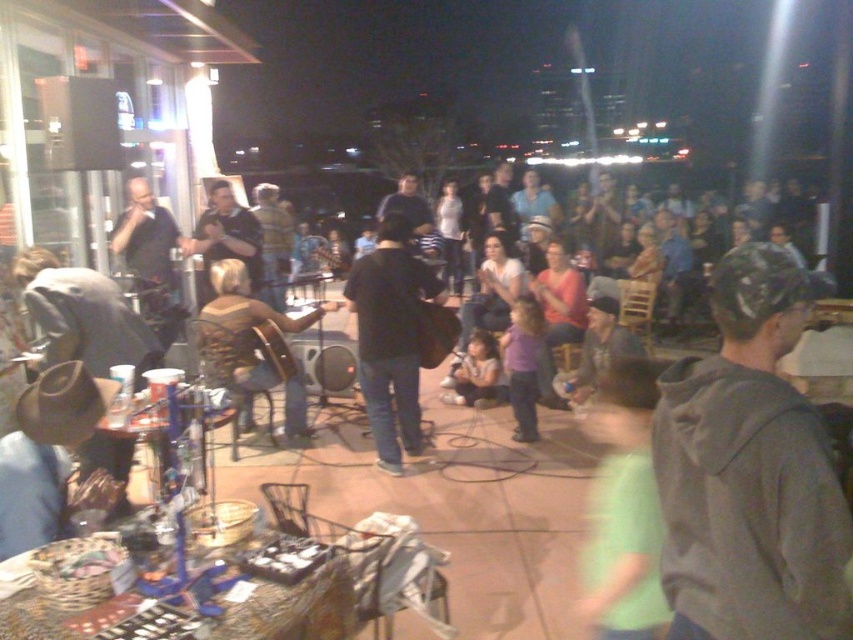
Question: Which point is farther from the camera taking this photo?

Choices:
 (A) [381, 381]
 (B) [675, 384]
 (C) [248, 348]

Answer: (C)

Question: Does black leather jacket at center come in front of brown leather guitar at center?

Choices:
 (A) yes
 (B) no

Answer: (A)

Question: Is gray matte hoodie at center further to camera compared to brown leather guitar at center?

Choices:
 (A) no
 (B) yes

Answer: (A)

Question: Considering the relative positions of gray matte hoodie at center and black leather jacket at center in the image provided, where is gray matte hoodie at center located with respect to black leather jacket at center?

Choices:
 (A) left
 (B) right

Answer: (B)

Question: Which of the following is the closest to the observer?

Choices:
 (A) black leather jacket at center
 (B) brown leather guitar at center
 (C) gray matte hoodie at center

Answer: (C)

Question: Among these objects, which one is nearest to the camera?

Choices:
 (A) gray matte hoodie at center
 (B) black leather jacket at center
 (C) brown leather guitar at center

Answer: (A)